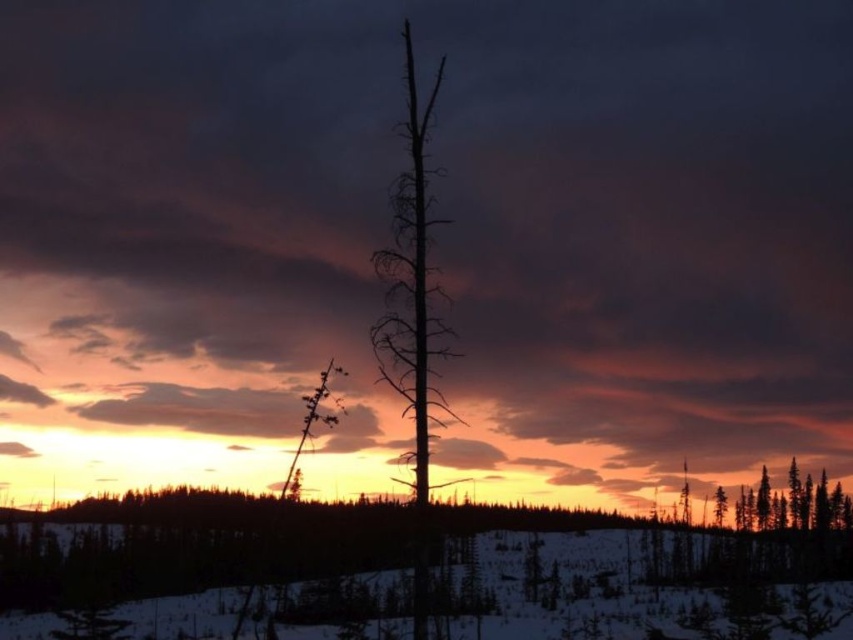
Does white matte snow at center have a smaller size compared to smooth brown tree trunk at right?

Incorrect, white matte snow at center is not smaller in size than smooth brown tree trunk at right.

Can you confirm if white matte snow at center is positioned below smooth brown tree trunk at right?

Indeed, white matte snow at center is positioned under smooth brown tree trunk at right.

Is point (148, 564) positioned before point (724, 512)?

No.

Where is `white matte snow at center`? white matte snow at center is located at coordinates (643, 584).

How distant is white matte snow at center from silhouette deadwood at center?

white matte snow at center is 26.31 meters away from silhouette deadwood at center.

Looking at this image, is white matte snow at center wider than silhouette deadwood at center?

Yes.

Between point (485, 600) and point (434, 172), which one is positioned in front?

Positioned in front is point (434, 172).

What are the coordinates of `white matte snow at center` in the screenshot? It's located at (643, 584).

What do you see at coordinates (413, 317) in the screenshot? The height and width of the screenshot is (640, 853). I see `silhouette deadwood at center` at bounding box center [413, 317].

From the picture: Is silhouette deadwood at center closer to camera compared to smooth brown tree trunk at right?

Yes, silhouette deadwood at center is in front of smooth brown tree trunk at right.

This screenshot has width=853, height=640. Identify the location of silhouette deadwood at center. (413, 317).